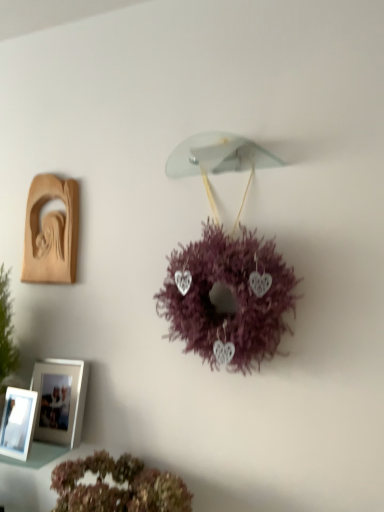
Question: Does white glossy picture frame at lower left, arranged as the 2th picture frame when viewed from the top, contain wooden carving at left, which ranks as the first picture frame in top-to-bottom order?

Choices:
 (A) no
 (B) yes

Answer: (A)

Question: Considering the relative sizes of white glossy picture frame at lower left, which is counted as the second picture frame, starting from the bottom, and wooden carving at left, which appears as the third picture frame when ordered from the bottom, in the image provided, is white glossy picture frame at lower left, which is counted as the second picture frame, starting from the bottom, wider than wooden carving at left, which appears as the third picture frame when ordered from the bottom,?

Choices:
 (A) yes
 (B) no

Answer: (A)

Question: Can you confirm if white glossy picture frame at lower left, which is counted as the second picture frame, starting from the bottom, is smaller than wooden carving at left, which appears as the third picture frame when ordered from the bottom?

Choices:
 (A) no
 (B) yes

Answer: (A)

Question: Considering the relative positions of white glossy picture frame at lower left, arranged as the 2th picture frame when viewed from the top, and wooden carving at left, which appears as the third picture frame when ordered from the bottom, in the image provided, is white glossy picture frame at lower left, arranged as the 2th picture frame when viewed from the top, to the left of wooden carving at left, which appears as the third picture frame when ordered from the bottom, from the viewer's perspective?

Choices:
 (A) no
 (B) yes

Answer: (A)

Question: From a real-world perspective, does white glossy picture frame at lower left, arranged as the 2th picture frame when viewed from the top, stand above wooden carving at left, which appears as the third picture frame when ordered from the bottom?

Choices:
 (A) no
 (B) yes

Answer: (A)

Question: Is purple fluffy wreath at center, the 1th flower in the top-to-bottom sequence, inside or outside of fluffy pink wreath at lower center, which ranks as the second flower in top-to-bottom order?

Choices:
 (A) outside
 (B) inside

Answer: (A)

Question: Considering the positions of purple fluffy wreath at center, the 1th flower in the top-to-bottom sequence, and fluffy pink wreath at lower center, the 1th flower from the bottom, in the image, is purple fluffy wreath at center, the 1th flower in the top-to-bottom sequence, taller or shorter than fluffy pink wreath at lower center, the 1th flower from the bottom,?

Choices:
 (A) short
 (B) tall

Answer: (B)

Question: From the image's perspective, relative to fluffy pink wreath at lower center, which ranks as the second flower in top-to-bottom order, is purple fluffy wreath at center, the 1th flower in the top-to-bottom sequence, above or below?

Choices:
 (A) below
 (B) above

Answer: (B)

Question: Considering their positions, is purple fluffy wreath at center, the second flower positioned from the bottom, located in front of or behind fluffy pink wreath at lower center, the 1th flower from the bottom?

Choices:
 (A) behind
 (B) front

Answer: (A)

Question: Relative to white glossy picture frame at lower left, the third picture frame when ordered from top to bottom, is wooden carving at left, which appears as the third picture frame when ordered from the bottom, in front or behind?

Choices:
 (A) front
 (B) behind

Answer: (B)

Question: From their relative heights in the image, would you say wooden carving at left, which appears as the third picture frame when ordered from the bottom, is taller or shorter than white glossy picture frame at lower left, the third picture frame when ordered from top to bottom?

Choices:
 (A) short
 (B) tall

Answer: (B)

Question: Do you think wooden carving at left, which ranks as the first picture frame in top-to-bottom order, is within white glossy picture frame at lower left, the third picture frame when ordered from top to bottom, or outside of it?

Choices:
 (A) outside
 (B) inside

Answer: (A)

Question: Considering the positions of point (61, 246) and point (21, 449), is point (61, 246) closer or farther from the camera than point (21, 449)?

Choices:
 (A) farther
 (B) closer

Answer: (A)

Question: In terms of height, does white glossy picture frame at lower left, which is counted as the second picture frame, starting from the bottom, look taller or shorter compared to white glossy picture frame at lower left, the third picture frame when ordered from top to bottom?

Choices:
 (A) tall
 (B) short

Answer: (A)

Question: Is white glossy picture frame at lower left, arranged as the 2th picture frame when viewed from the top, bigger or smaller than white glossy picture frame at lower left, the third picture frame when ordered from top to bottom?

Choices:
 (A) small
 (B) big

Answer: (B)